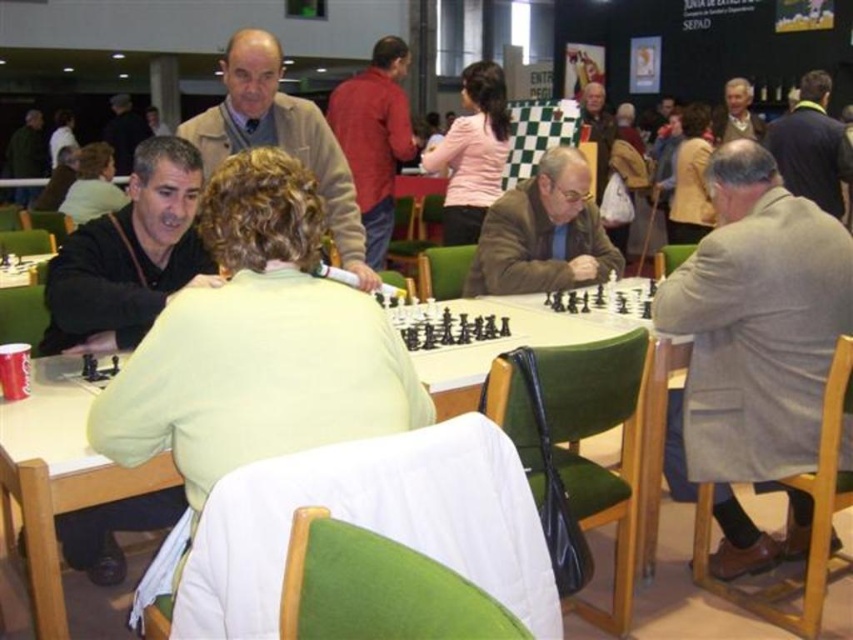
You are a photographer standing in the middle of the chess tournament room. You want to take a photo of the gray woolen coat at right without moving any objects. Can you capture it in your current position?

The gray woolen coat at right is 2.09 meters from the viewer, so yes, you can capture it in your current position as it is within a reasonable distance for photography.